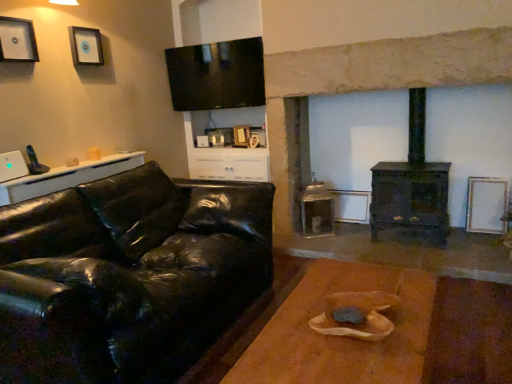
Question: Does brown wooden table at center, the 2th table in the back-to-front sequence, contain white matte picture frame at right, which appears as the third picture frame when viewed from the top?

Choices:
 (A) yes
 (B) no

Answer: (B)

Question: Considering the relative sizes of brown wooden table at center, the first table in the right-to-left sequence, and white matte picture frame at right, which appears as the third picture frame when viewed from the left, in the image provided, is brown wooden table at center, the first table in the right-to-left sequence, thinner than white matte picture frame at right, which appears as the third picture frame when viewed from the left,?

Choices:
 (A) no
 (B) yes

Answer: (A)

Question: From the image's perspective, is brown wooden table at center, the 2th table in the back-to-front sequence, on white matte picture frame at right, marked as the 1th picture frame in a back-to-front arrangement?

Choices:
 (A) no
 (B) yes

Answer: (A)

Question: From a real-world perspective, is brown wooden table at center, the second table viewed from the top, physically below white matte picture frame at right, which appears as the third picture frame when viewed from the top?

Choices:
 (A) yes
 (B) no

Answer: (A)

Question: From a real-world perspective, is brown wooden table at center, the second table viewed from the top, physically above white matte picture frame at right, marked as the first picture frame in a bottom-to-top arrangement?

Choices:
 (A) no
 (B) yes

Answer: (A)

Question: Considering the positions of point (202, 269) and point (198, 61), is point (202, 269) closer or farther from the camera than point (198, 61)?

Choices:
 (A) farther
 (B) closer

Answer: (B)

Question: From a real-world perspective, is black leather couch at left physically located above or below matte black cabinet at upper center?

Choices:
 (A) below
 (B) above

Answer: (A)

Question: Considering the relative positions of black leather couch at left and matte black cabinet at upper center in the image provided, is black leather couch at left to the left or to the right of matte black cabinet at upper center?

Choices:
 (A) right
 (B) left

Answer: (B)

Question: From the image's perspective, is black leather couch at left located above or below matte black cabinet at upper center?

Choices:
 (A) above
 (B) below

Answer: (B)

Question: From the image's perspective, is brushed metal picture frame at upper left, which ranks as the third picture frame in right-to-left order, located above or below brown wooden table at center, marked as the second table in a left-to-right arrangement?

Choices:
 (A) below
 (B) above

Answer: (B)

Question: Considering the positions of brushed metal picture frame at upper left, which appears as the 1th picture frame when viewed from the front, and brown wooden table at center, placed as the 1th table when sorted from bottom to top, in the image, is brushed metal picture frame at upper left, which appears as the 1th picture frame when viewed from the front, wider or thinner than brown wooden table at center, placed as the 1th table when sorted from bottom to top,?

Choices:
 (A) wide
 (B) thin

Answer: (B)

Question: Relative to brown wooden table at center, the first table in the right-to-left sequence, is brushed metal picture frame at upper left, positioned as the third picture frame in back-to-front order, in front or behind?

Choices:
 (A) front
 (B) behind

Answer: (B)

Question: Do you think brushed metal picture frame at upper left, positioned as the third picture frame in back-to-front order, is within brown wooden table at center, marked as the second table in a left-to-right arrangement, or outside of it?

Choices:
 (A) inside
 (B) outside

Answer: (B)

Question: Which is correct: brushed metal picture frame at upper left, the 2th picture frame positioned from the top, is inside black leather couch at left, or outside of it?

Choices:
 (A) inside
 (B) outside

Answer: (B)

Question: Considering the positions of brushed metal picture frame at upper left, which appears as the 1th picture frame when viewed from the front, and black leather couch at left in the image, is brushed metal picture frame at upper left, which appears as the 1th picture frame when viewed from the front, taller or shorter than black leather couch at left?

Choices:
 (A) tall
 (B) short

Answer: (B)